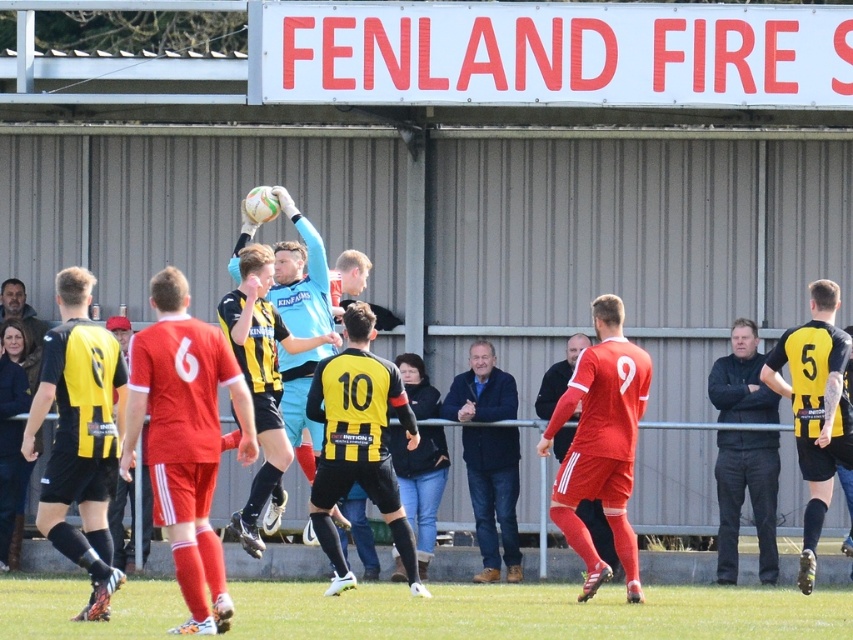
Question: Is the position of black/yellow jersey at center less distant than that of matte red jersey at center?

Choices:
 (A) yes
 (B) no

Answer: (A)

Question: Which object is the closest to the black leather jacket at right?

Choices:
 (A) matte blue goalkeeper at center
 (B) blue woolen jacket at center

Answer: (B)

Question: Which object is closer to the camera taking this photo?

Choices:
 (A) black/yellow jersey at center
 (B) black leather jacket at right

Answer: (A)

Question: Can you confirm if black leather jacket at right is positioned to the left of matte blue goalkeeper at center?

Choices:
 (A) no
 (B) yes

Answer: (A)

Question: Which object is the farthest from the black leather jacket at right?

Choices:
 (A) black/yellow jersey at center
 (B) green grass at center
 (C) blue woolen jacket at center

Answer: (A)

Question: Is black/yellow jersey at center wider than matte blue goalkeeper at center?

Choices:
 (A) no
 (B) yes

Answer: (B)